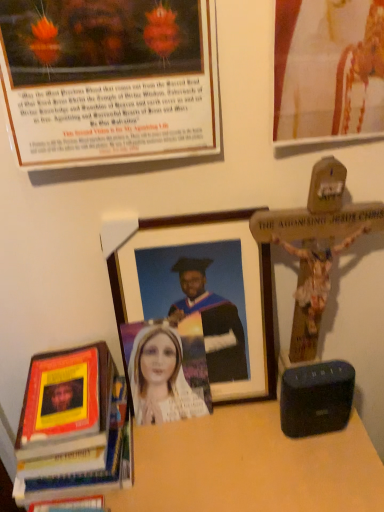
Where is `free space in front of wooden picture frame at center, acting as the 1th picture frame starting from the bottom`? Image resolution: width=384 pixels, height=512 pixels. free space in front of wooden picture frame at center, acting as the 1th picture frame starting from the bottom is located at coordinates (213, 460).